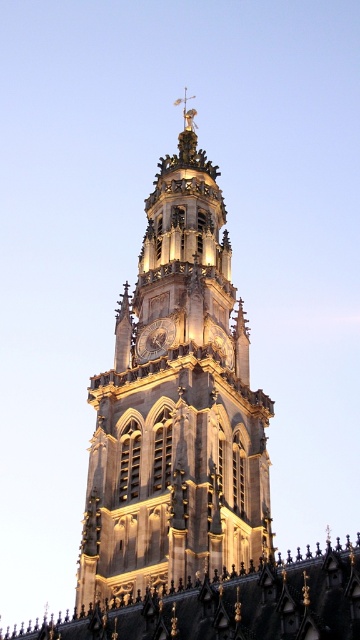
You are a maintenance worker needing to reach both the golden stone tower at center and the golden metallic clock at center for inspection. You have a ladder that can extend up to 12 meters. Can you safely inspect both objects with your current ladder?

The golden stone tower at center and golden metallic clock at center are 13.51 meters apart from each other. Since your ladder only extends up to 12 meters, you cannot safely reach both objects with your current ladder.

You are an architect analyzing the Gothic tower. Based on the image, which object is taller between the golden stone tower at center and the golden metallic clock at center?

The golden stone tower at center is much taller than the golden metallic clock at center.

You are standing in front of the Gothic tower and want to find the point at coordinates [177,406]. Where exactly on the tower should you look?

The point at coordinates [177,406] is located on the golden stone tower at center.